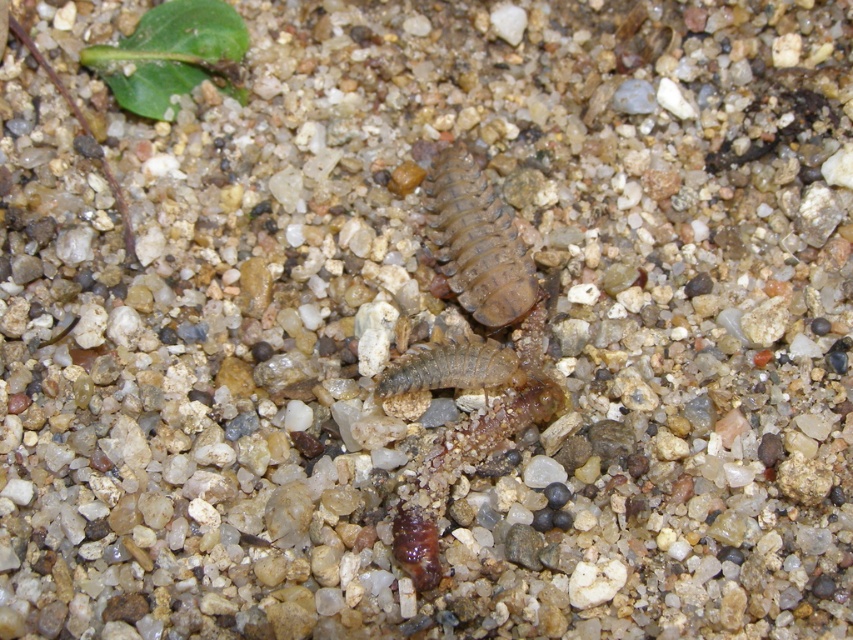
From the picture: You are a photographer trying to capture both the brown fuzzy caterpillar at center and the brown fuzzy caterpillar at lower center in a single photo. Since you want both to be clearly visible, which caterpillar might be partially hidden due to its position relative to the other?

The brown fuzzy caterpillar at lower center is behind the brown fuzzy caterpillar at center, so it might be partially hidden in the photo.

Consider the image. You are a geologist examining the sandy and gravelly surface in the image. You notice a point marked at coordinates (477, 241). What object is located at this point?

At point (477, 241) lies brown rough centipede at center.

You are standing at the point labeled as point (480,236) on the sandy and gravelly surface. You want to pick up a small pebble that is exactly 2 feet away from you. Is there enough space between you and the pebble to comfortably fit your hand?

The distance between you and the pebble is 2 feet, which is less than the 4.10 feet between you and the viewer. Since 2 feet is a comfortable distance for hand placement, there is enough space.